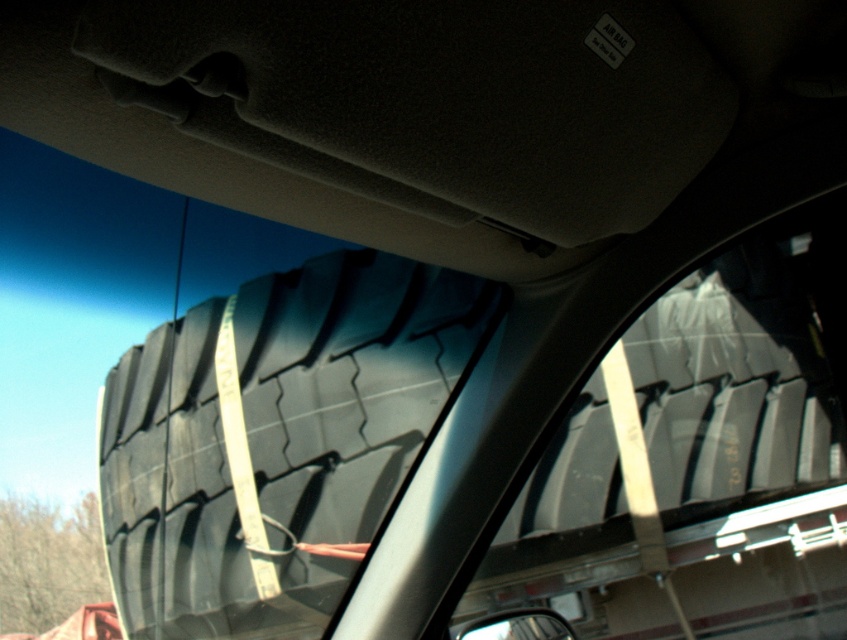
You are a driver trying to adjust your rearview mirror to get a better view of the road behind you. The glossy plastic view mirror at lower center is currently reflecting the black rubber tire at center. Can you move the mirror to avoid reflecting the tire?

The black rubber tire at center is positioned on the left side of the glossy plastic view mirror at lower center. Since the tire is to the left of the mirror, adjusting the mirror to the right might help avoid reflecting the tire, but this depends on the mirror adjustment range and the tire position relative to the vehicle.

You are driving a car and need to check the size of the transparent plastic window at center and the black rubber tire at center. Which one has a smaller width?

The transparent plastic window at center has a smaller width than the black rubber tire at center.